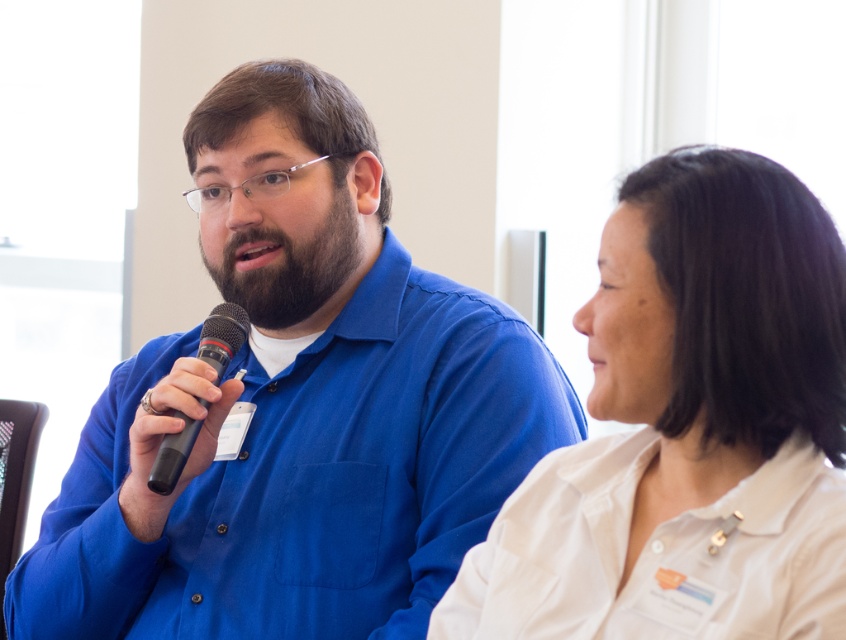
Question: Based on their relative distances, which object is farther from the dark brown beard at center?

Choices:
 (A) black rubber microphone at left
 (B) white matte shirt at upper right
 (C) matte blue shirt at center

Answer: (B)

Question: Which point is farther to the camera?

Choices:
 (A) white matte shirt at upper right
 (B) dark brown beard at center
 (C) black rubber microphone at left
 (D) matte blue shirt at center

Answer: (B)

Question: Does matte blue shirt at center have a larger size compared to white matte shirt at upper right?

Choices:
 (A) yes
 (B) no

Answer: (A)

Question: Considering the real-world distances, which object is closest to the dark brown beard at center?

Choices:
 (A) white matte shirt at upper right
 (B) matte blue shirt at center

Answer: (B)

Question: Does matte blue shirt at center appear under dark brown beard at center?

Choices:
 (A) yes
 (B) no

Answer: (A)

Question: Where is white matte shirt at upper right located in relation to black rubber microphone at left in the image?

Choices:
 (A) left
 (B) right

Answer: (B)